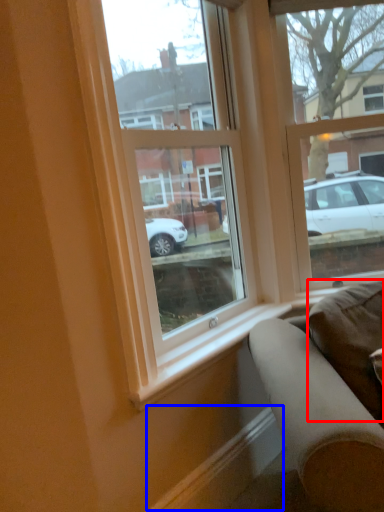
Question: Among these objects, which one is farthest to the camera, pillow (highlighted by a red box) or curb (highlighted by a blue box)?

Choices:
 (A) pillow
 (B) curb

Answer: (B)